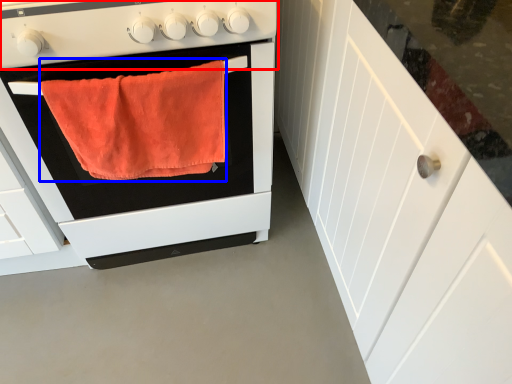
Question: Which object is further to the camera taking this photo, gas stove (highlighted by a red box) or bath towel (highlighted by a blue box)?

Choices:
 (A) gas stove
 (B) bath towel

Answer: (B)